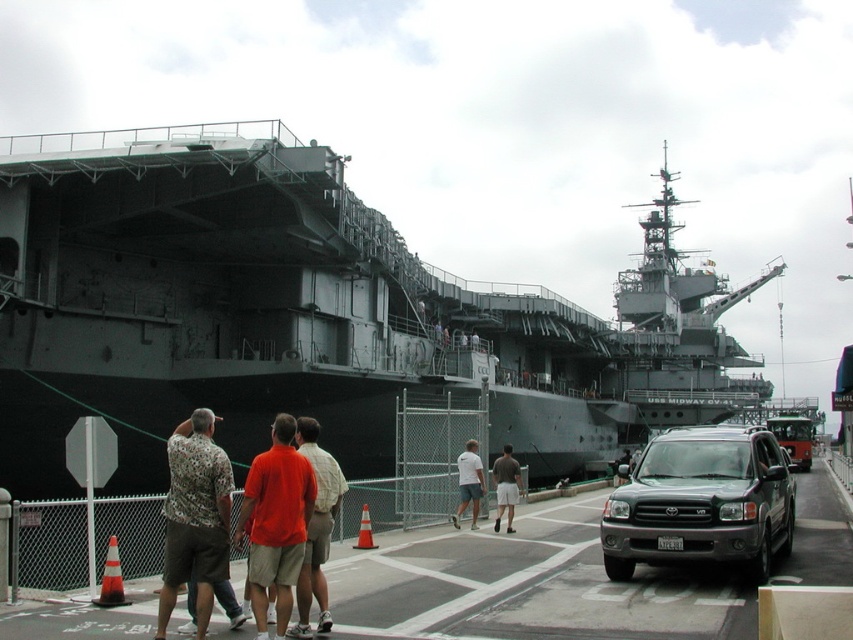
You are a photographer standing at the edge of the USS Midway CV 41 aircraft carrier deck. You see an orange shirt at center and a brown cotton shorts at center. To capture both subjects in a single photo, should you pan your camera to the left or right?

Result: The orange shirt at center is to the left of brown cotton shorts at center. To capture both subjects in a single photo, you should pan your camera to the right to include the orange shirt at center and the brown cotton shorts at center in the frame.

What is the exact coordinate of the printed fabric shirt at center in the image?

The printed fabric shirt at center is located at coordinate point (195, 518).